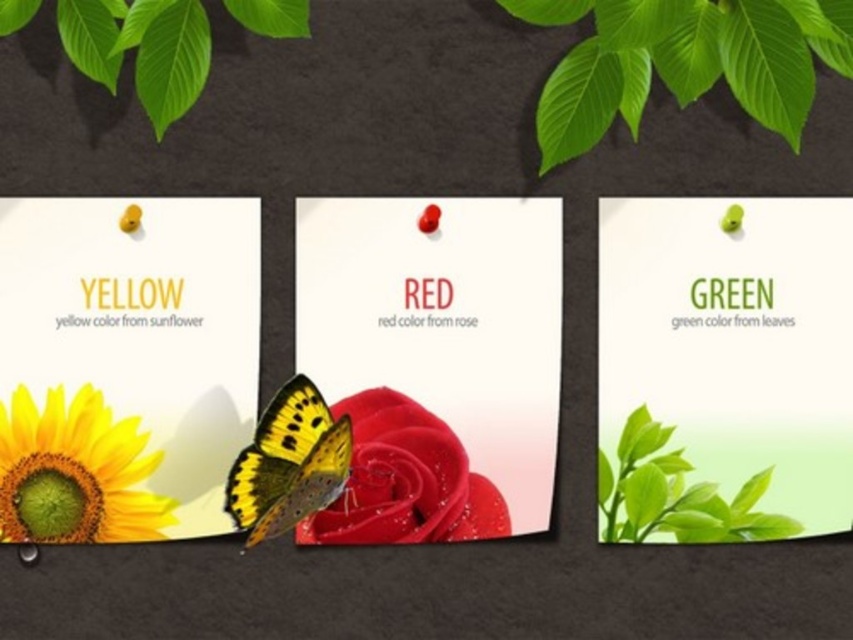
You are an artist trying to arrange two elements for a painting. You have a green matte leaves at center and a matte yellow sunflower at lower left. Based on their sizes, which element should you choose if you want to place a small decorative stone next to the wider one?

The green matte leaves at center might be wider than the matte yellow sunflower at lower left, so you should place the small decorative stone next to the green matte leaves at center.

You are an art curator arranging an exhibition about floral patterns. You have two elements to consider in your layout design, the green matte leaves at center and the matte yellow sunflower at lower left. Based on their sizes, which element should you place in a position that requires more vertical space?

The green matte leaves at center has a greater height compared to the matte yellow sunflower at lower left, so it should be placed in a position that requires more vertical space.